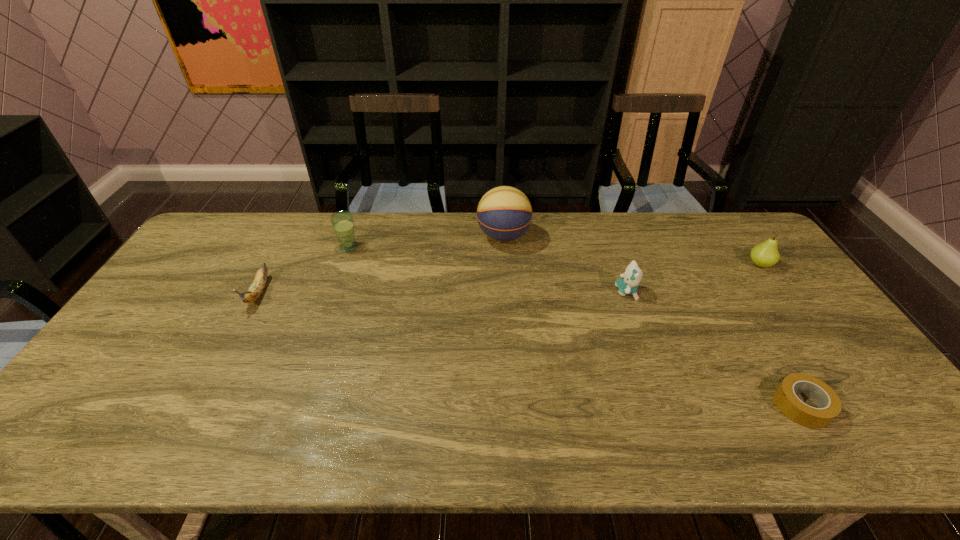
In the image, there is a desktop. Find the location of `vacant space at the right edge`. vacant space at the right edge is located at coordinates (816, 318).

Image resolution: width=960 pixels, height=540 pixels. In order to click on free space at the far left corner of the desktop in this screenshot , I will do `click(217, 251)`.

In the image, there is a desktop. Where is `vacant space at the near left corner`? vacant space at the near left corner is located at coordinates (97, 421).

Where is `free point between the fifth object from right to left and the pear`? The height and width of the screenshot is (540, 960). free point between the fifth object from right to left and the pear is located at coordinates (554, 255).

This screenshot has height=540, width=960. I want to click on empty location between the banana and the second object from left to right, so click(x=303, y=270).

Identify the location of unoccupied area between the kitten and the duct tape. (713, 348).

The width and height of the screenshot is (960, 540). In order to click on empty space that is in between the pear and the shortest object in this screenshot , I will do `click(780, 335)`.

In order to click on free area in between the kitten and the fourth object from right to left in this screenshot , I will do `click(564, 264)`.

Identify the location of free point between the leftmost object and the pear. This screenshot has height=540, width=960. (510, 279).

This screenshot has height=540, width=960. I want to click on free area in between the leftmost object and the glass, so click(303, 270).